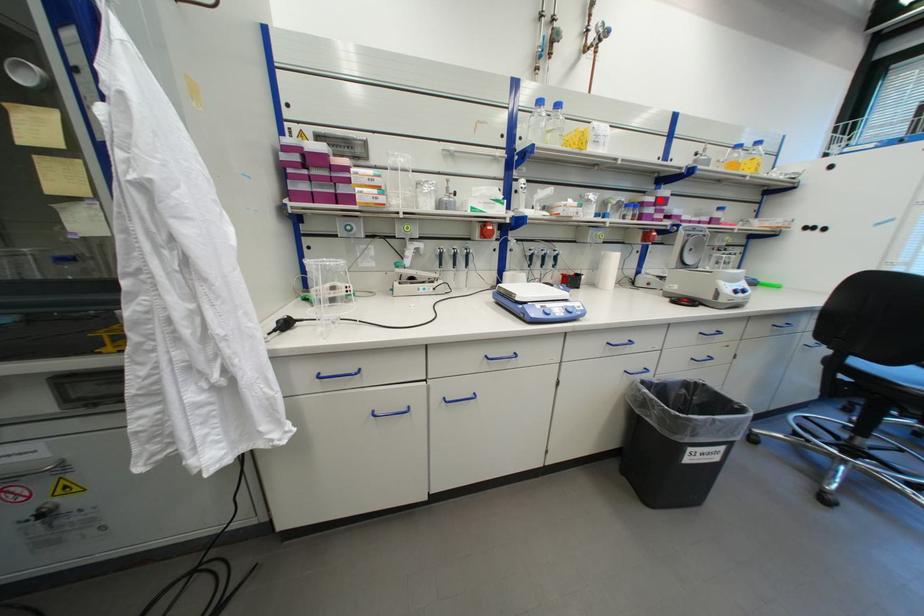
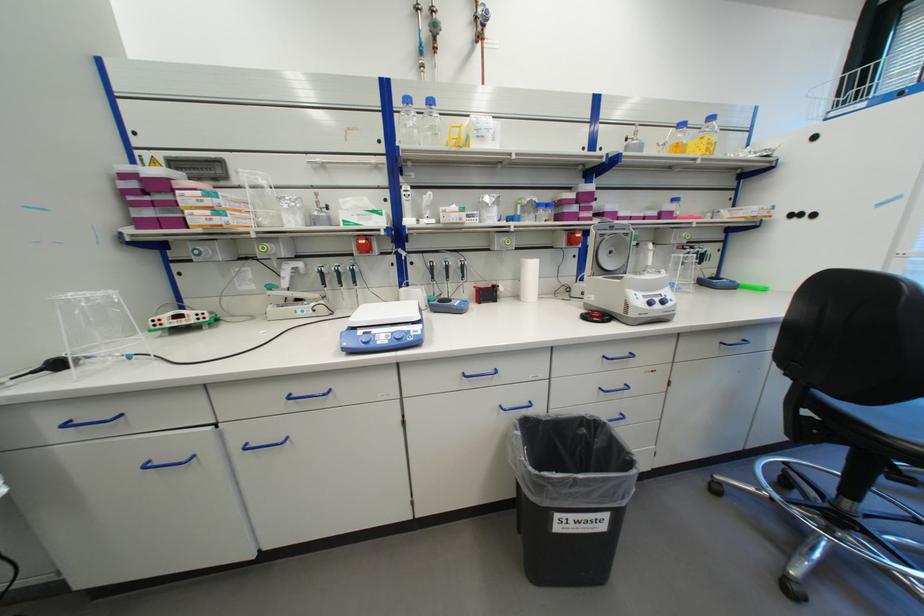
Find the pixel in the second image that matches the highlighted location in the first image.

(579, 197)